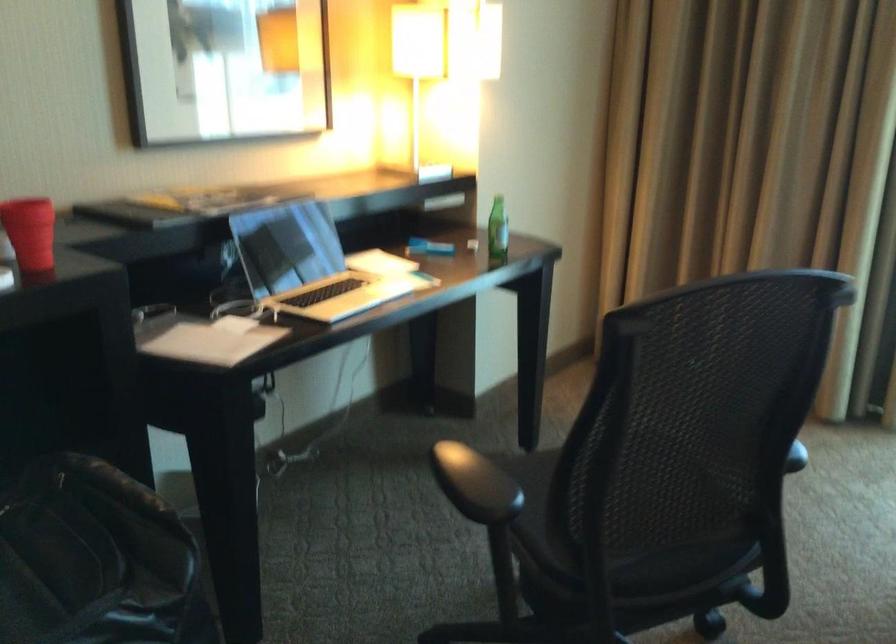
Where is `green glass bottle`? This screenshot has width=896, height=644. green glass bottle is located at coordinates (497, 229).